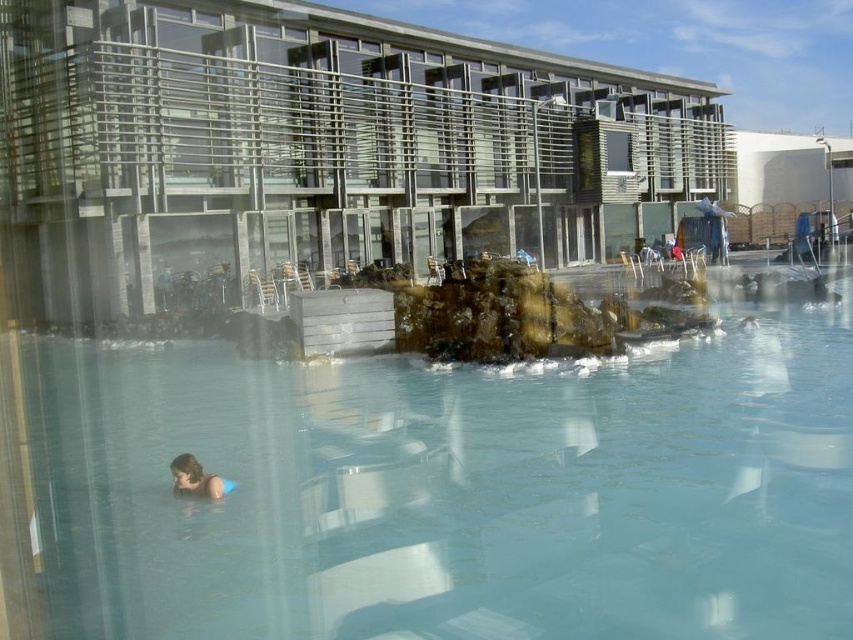
Question: Is metallic glass building at center positioned at the back of smooth skin person at lower left?

Choices:
 (A) yes
 (B) no

Answer: (A)

Question: Is clear glass water at center above smooth skin person at lower left?

Choices:
 (A) no
 (B) yes

Answer: (B)

Question: Where is clear glass water at center located in relation to smooth skin person at lower left in the image?

Choices:
 (A) below
 (B) above

Answer: (B)

Question: Which of these objects is positioned farthest from the smooth skin person at lower left?

Choices:
 (A) metallic glass building at center
 (B) clear glass water at center

Answer: (A)

Question: Which point is farther to the camera?

Choices:
 (A) (201, 486)
 (B) (728, 486)
 (C) (643, 177)

Answer: (C)

Question: Which of these objects is positioned closest to the smooth skin person at lower left?

Choices:
 (A) clear glass water at center
 (B) metallic glass building at center

Answer: (A)